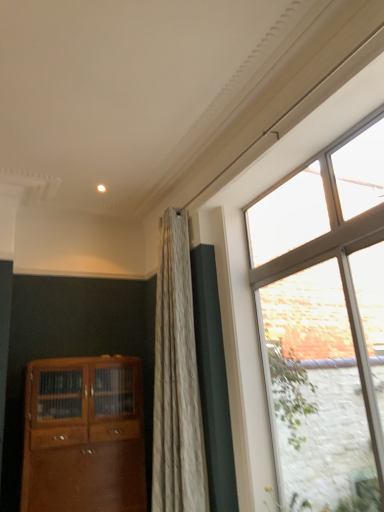
Question: Is clear glass window at right placed right next to matte wood cabinet at lower left?

Choices:
 (A) yes
 (B) no

Answer: (B)

Question: From a real-world perspective, is clear glass window at right physically below matte wood cabinet at lower left?

Choices:
 (A) no
 (B) yes

Answer: (A)

Question: Does clear glass window at right appear on the left side of matte wood cabinet at lower left?

Choices:
 (A) yes
 (B) no

Answer: (B)

Question: Is clear glass window at right in front of matte wood cabinet at lower left?

Choices:
 (A) no
 (B) yes

Answer: (B)

Question: Can you confirm if clear glass window at right is positioned to the right of matte wood cabinet at lower left?

Choices:
 (A) no
 (B) yes

Answer: (B)

Question: Considering the positions of clear glass window at right and matte wood cabinet at lower left in the image, is clear glass window at right wider or thinner than matte wood cabinet at lower left?

Choices:
 (A) wide
 (B) thin

Answer: (B)

Question: Is clear glass window at right bigger or smaller than matte wood cabinet at lower left?

Choices:
 (A) big
 (B) small

Answer: (B)

Question: Is clear glass window at right in front of or behind matte wood cabinet at lower left in the image?

Choices:
 (A) behind
 (B) front

Answer: (B)

Question: From a real-world perspective, relative to matte wood cabinet at lower left, is clear glass window at right vertically above or below?

Choices:
 (A) below
 (B) above

Answer: (B)

Question: From their relative heights in the image, would you say matte wood cabinet at lower left is taller or shorter than clear glass window at right?

Choices:
 (A) tall
 (B) short

Answer: (B)

Question: Is point (59, 501) positioned closer to the camera than point (324, 501)?

Choices:
 (A) farther
 (B) closer

Answer: (B)

Question: From a real-world perspective, is matte wood cabinet at lower left above or below clear glass window at right?

Choices:
 (A) above
 (B) below

Answer: (B)

Question: From the image's perspective, is matte wood cabinet at lower left positioned above or below clear glass window at right?

Choices:
 (A) below
 (B) above

Answer: (A)

Question: Considering the positions of clear glass window at right and clear glass door at right in the image, is clear glass window at right taller or shorter than clear glass door at right?

Choices:
 (A) short
 (B) tall

Answer: (B)

Question: Is clear glass window at right in front of or behind clear glass door at right in the image?

Choices:
 (A) behind
 (B) front

Answer: (A)